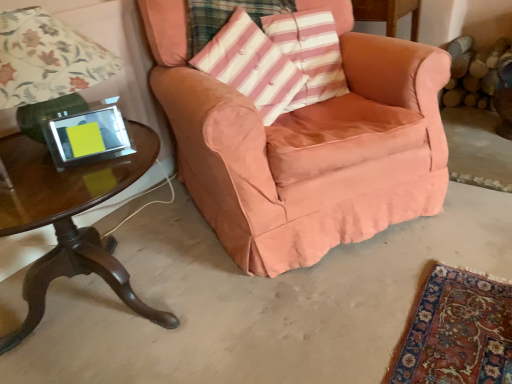
Image resolution: width=512 pixels, height=384 pixels. I want to click on free space in front of suede-like peach armchair at center, so click(x=355, y=306).